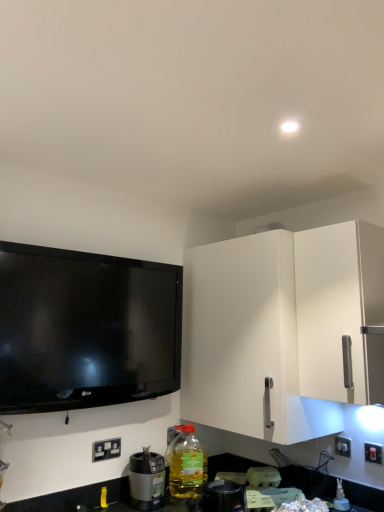
At what (x,y) coordinates should I click in order to perform the action: click on black plastic blender at lower left, the second appliance when ordered from front to back. Please return your answer as a coordinate pair (x, y). Image resolution: width=384 pixels, height=512 pixels. Looking at the image, I should click on (146, 479).

The height and width of the screenshot is (512, 384). In order to click on translucent plastic bottle at lower center in this screenshot , I will do `click(186, 464)`.

Measure the distance between translucent plastic bottle at lower center and camera.

translucent plastic bottle at lower center and camera are 6.09 feet apart from each other.

Locate an element on the screen. This screenshot has width=384, height=512. white plastic switch at lower right, which is counted as the second electric outlet, starting from the left is located at coordinates (373, 453).

Measure the distance between white plastic switch at lower right, which is counted as the second electric outlet, starting from the left, and camera.

They are 6.12 feet apart.

What do you see at coordinates (223, 496) in the screenshot? Image resolution: width=384 pixels, height=512 pixels. I see `metallic silver blender at lower center, placed as the 1th appliance when sorted from right to left` at bounding box center [223, 496].

Find the location of `white matte cabinet at right`. white matte cabinet at right is located at coordinates (278, 326).

Where is `black plastic blender at lower left, which is the 2th appliance from right to left`? black plastic blender at lower left, which is the 2th appliance from right to left is located at coordinates (146, 479).

Considering the positions of objects black plastic blender at lower left, which is the 2th appliance from right to left, and white matte cabinet at right in the image provided, who is more to the left, black plastic blender at lower left, which is the 2th appliance from right to left, or white matte cabinet at right?

Positioned to the left is black plastic blender at lower left, which is the 2th appliance from right to left.

Is point (150, 500) behind point (282, 301)?

That is True.

From the image's perspective, is black plastic blender at lower left, the 1th appliance positioned from the back, beneath white matte cabinet at right?

Yes.

In the image, is black plastic blender at lower left, which is the 2th appliance from right to left, on the left side or the right side of translucent plastic bottle at lower center?

Clearly, black plastic blender at lower left, which is the 2th appliance from right to left, is on the left of translucent plastic bottle at lower center in the image.

Consider the image. Is the surface of black plastic blender at lower left, which is the 2th appliance from right to left, in direct contact with translucent plastic bottle at lower center?

They are not placed beside each other.

Which object is closer to the camera, black plastic blender at lower left, acting as the 1th appliance starting from the left, or translucent plastic bottle at lower center?

black plastic blender at lower left, acting as the 1th appliance starting from the left.

Considering the positions of points (147, 490) and (172, 474), is point (147, 490) closer to camera compared to point (172, 474)?

Yes, it is.

How distant is metallic silver blender at lower center, positioned as the first appliance in front-to-back order, from white plastic electrical outlet at lower left, acting as the first electric outlet starting from the left?

metallic silver blender at lower center, positioned as the first appliance in front-to-back order, and white plastic electrical outlet at lower left, acting as the first electric outlet starting from the left, are 20.49 inches apart.

Is metallic silver blender at lower center, placed as the 1th appliance when sorted from right to left, positioned far away from white plastic electrical outlet at lower left, placed as the second electric outlet when sorted from right to left?

No, metallic silver blender at lower center, placed as the 1th appliance when sorted from right to left, is not far from white plastic electrical outlet at lower left, placed as the second electric outlet when sorted from right to left.

Locate an element on the screen. the 2nd appliance below the white plastic electrical outlet at lower left, placed as the second electric outlet when sorted from right to left (from a real-world perspective) is located at coordinates (223, 496).

Based on their positions, is metallic silver blender at lower center, the 2th appliance from the left, located to the left or right of white plastic electrical outlet at lower left, placed as the second electric outlet when sorted from right to left?

Based on their positions, metallic silver blender at lower center, the 2th appliance from the left, is located to the right of white plastic electrical outlet at lower left, placed as the second electric outlet when sorted from right to left.

From a real-world perspective, which object stands above the other?

white plastic electrical outlet at lower left, placed as the second electric outlet when sorted from right to left, from a real-world perspective.

Image resolution: width=384 pixels, height=512 pixels. Identify the location of bottle below the white plastic electrical outlet at lower left, acting as the first electric outlet starting from the left (from the image's perspective). (186, 464).

Between white plastic electrical outlet at lower left, acting as the first electric outlet starting from the left, and translucent plastic bottle at lower center, which one appears on the right side from the viewer's perspective?

translucent plastic bottle at lower center is more to the right.

Does white plastic electrical outlet at lower left, acting as the first electric outlet starting from the left, contain translucent plastic bottle at lower center?

No, translucent plastic bottle at lower center is not a part of white plastic electrical outlet at lower left, acting as the first electric outlet starting from the left.

Which of these two, translucent plastic bottle at lower center or black plastic blender at lower left, which is the 2th appliance from right to left, is thinner?

Thinner between the two is black plastic blender at lower left, which is the 2th appliance from right to left.

Find the location of a particular element. The height and width of the screenshot is (512, 384). bottle on the right of the black plastic blender at lower left, acting as the 1th appliance starting from the left is located at coordinates (186, 464).

Is point (173, 466) behind point (157, 504)?

Yes, point (173, 466) is farther from viewer.

Is translucent plastic bottle at lower center far away from black plastic blender at lower left, the second appliance when ordered from front to back?

They are positioned close to each other.

Is white plastic switch at lower right, which is counted as the second electric outlet, starting from the left, bigger than white plastic electrical outlet at lower left, placed as the second electric outlet when sorted from right to left?

Correct, white plastic switch at lower right, which is counted as the second electric outlet, starting from the left, is larger in size than white plastic electrical outlet at lower left, placed as the second electric outlet when sorted from right to left.

From the image's perspective, is white plastic switch at lower right, which is counted as the second electric outlet, starting from the left, positioned above or below white plastic electrical outlet at lower left, placed as the second electric outlet when sorted from right to left?

white plastic switch at lower right, which is counted as the second electric outlet, starting from the left, is situated higher than white plastic electrical outlet at lower left, placed as the second electric outlet when sorted from right to left, in the image.

Would you consider white plastic switch at lower right, the first electric outlet in the right-to-left sequence, to be distant from white plastic electrical outlet at lower left, placed as the second electric outlet when sorted from right to left?

Absolutely, white plastic switch at lower right, the first electric outlet in the right-to-left sequence, is distant from white plastic electrical outlet at lower left, placed as the second electric outlet when sorted from right to left.

Which point is more distant from viewer, (193, 442) or (107, 452)?

The point (193, 442) is farther.

Are translucent plastic bottle at lower center and white plastic electrical outlet at lower left, acting as the first electric outlet starting from the left, making contact?

No, translucent plastic bottle at lower center is not touching white plastic electrical outlet at lower left, acting as the first electric outlet starting from the left.

From a real-world perspective, who is located higher, translucent plastic bottle at lower center or white plastic electrical outlet at lower left, placed as the second electric outlet when sorted from right to left?

white plastic electrical outlet at lower left, placed as the second electric outlet when sorted from right to left, is physically above.

The width and height of the screenshot is (384, 512). Identify the location of the 1st appliance below the white matte cabinet at right (from the image's perspective). (146, 479).

Where is `bottle on the right of black plastic blender at lower left, the second appliance when ordered from front to back`? bottle on the right of black plastic blender at lower left, the second appliance when ordered from front to back is located at coordinates (186, 464).

Based on their spatial positions, is white plastic electrical outlet at lower left, acting as the first electric outlet starting from the left, or metallic silver blender at lower center, positioned as the first appliance in front-to-back order, further from translucent plastic bottle at lower center?

white plastic electrical outlet at lower left, acting as the first electric outlet starting from the left, lies further to translucent plastic bottle at lower center than the other object.

Based on their spatial positions, is black plastic blender at lower left, the 1th appliance positioned from the back, or translucent plastic bottle at lower center closer to white plastic switch at lower right, the first electric outlet in the right-to-left sequence?

translucent plastic bottle at lower center is positioned closer to the anchor white plastic switch at lower right, the first electric outlet in the right-to-left sequence.

Which object lies further to the anchor point black plastic blender at lower left, the second appliance when ordered from front to back, translucent plastic bottle at lower center or metallic silver blender at lower center, placed as the 1th appliance when sorted from right to left?

Among the two, metallic silver blender at lower center, placed as the 1th appliance when sorted from right to left, is located further to black plastic blender at lower left, the second appliance when ordered from front to back.

When comparing their distances from translucent plastic bottle at lower center, does white plastic switch at lower right, which is counted as the second electric outlet, starting from the left, or white matte cabinet at right seem closer?

The object closer to translucent plastic bottle at lower center is white matte cabinet at right.

When comparing their distances from black plastic blender at lower left, the second appliance when ordered from front to back, does white plastic electrical outlet at lower left, placed as the second electric outlet when sorted from right to left, or white matte cabinet at right seem further?

Among the two, white matte cabinet at right is located further to black plastic blender at lower left, the second appliance when ordered from front to back.

Which object lies nearer to the anchor point metallic silver blender at lower center, positioned as the first appliance in front-to-back order, white matte cabinet at right or white plastic switch at lower right, which is counted as the second electric outlet, starting from the left?

white matte cabinet at right lies closer to metallic silver blender at lower center, positioned as the first appliance in front-to-back order, than the other object.

Looking at the image, which one is located further to white matte cabinet at right, metallic silver blender at lower center, placed as the 1th appliance when sorted from right to left, or white plastic switch at lower right, which is counted as the second electric outlet, starting from the left?

Based on the image, white plastic switch at lower right, which is counted as the second electric outlet, starting from the left, appears to be further to white matte cabinet at right.

Which object lies nearer to the anchor point translucent plastic bottle at lower center, black plastic blender at lower left, the second appliance when ordered from front to back, or metallic silver blender at lower center, the 2th appliance when ordered from back to front?

The object closer to translucent plastic bottle at lower center is black plastic blender at lower left, the second appliance when ordered from front to back.

Identify the location of bottle between black plastic blender at lower left, the 1th appliance positioned from the back, and white plastic switch at lower right, which is counted as the second electric outlet, starting from the left, from left to right. The image size is (384, 512). (186, 464).

You are a GUI agent. You are given a task and a screenshot of the screen. Output one action in this format:
    pyautogui.click(x=<x>, y=<y>)
    Task: Click on the appliance between white plastic electrical outlet at lower left, placed as the second electric outlet when sorted from right to left, and metallic silver blender at lower center, the 2th appliance from the left, from left to right
    The height and width of the screenshot is (512, 384).
    Given the screenshot: What is the action you would take?
    pyautogui.click(x=146, y=479)

Locate an element on the screen. Image resolution: width=384 pixels, height=512 pixels. cabinetry located between white plastic electrical outlet at lower left, placed as the second electric outlet when sorted from right to left, and white plastic switch at lower right, the first electric outlet in the right-to-left sequence, in the left-right direction is located at coordinates (278, 326).

At what (x,y) coordinates should I click in order to perform the action: click on bottle between white matte cabinet at right and metallic silver blender at lower center, placed as the 1th appliance when sorted from right to left, in the vertical direction. Please return your answer as a coordinate pair (x, y). Looking at the image, I should click on (186, 464).